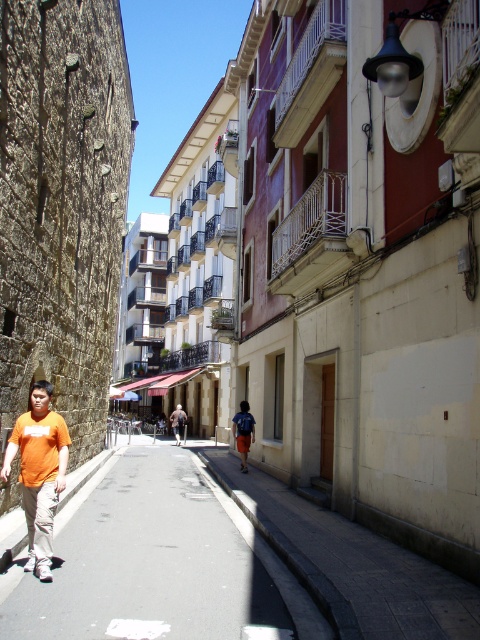
Question: Which of the following is the farthest from the observer?

Choices:
 (A) light brown leather jacket at center
 (B) smooth concrete sidewalk at center

Answer: (A)

Question: Which object is closer to the camera taking this photo?

Choices:
 (A) smooth concrete sidewalk at center
 (B) orange cotton shirt at left
 (C) light brown leather jacket at center

Answer: (A)

Question: Does smooth concrete sidewalk at center have a larger size compared to light brown leather jacket at center?

Choices:
 (A) no
 (B) yes

Answer: (A)

Question: Which object is closer to the camera taking this photo?

Choices:
 (A) smooth concrete sidewalk at center
 (B) smooth asphalt road at center
 (C) light brown leather jacket at center
 (D) orange cotton shirt at left

Answer: (A)

Question: Does smooth asphalt road at center have a greater width compared to orange cotton shirt at left?

Choices:
 (A) yes
 (B) no

Answer: (A)

Question: Observing the image, what is the correct spatial positioning of smooth concrete sidewalk at center in reference to light brown leather jacket at center?

Choices:
 (A) right
 (B) left

Answer: (A)